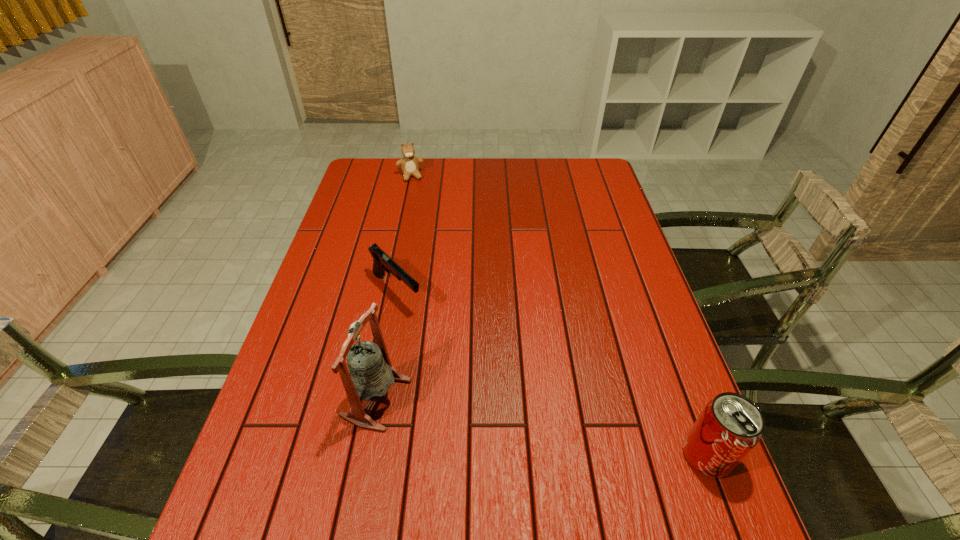
At what (x,y) coordinates should I click in order to perform the action: click on unoccupied area between the rightmost object and the second farthest object. Please return your answer as a coordinate pair (x, y). Looking at the image, I should click on (552, 374).

Find the location of a particular element. vacant area that lies between the farthest object and the third nearest object is located at coordinates (403, 234).

Identify the location of vacant space that is in between the farthest object and the third shortest object. (559, 316).

The image size is (960, 540). What are the coordinates of `free spot between the gun and the farthest object` in the screenshot? It's located at (403, 234).

You are a GUI agent. You are given a task and a screenshot of the screen. Output one action in this format:
    pyautogui.click(x=<x>, y=<y>)
    Task: Click on the vacant area that lies between the tallest object and the third shortest object
    
    Given the screenshot: What is the action you would take?
    pyautogui.click(x=541, y=427)

Where is `object that is the second closest to the tallest object`? Image resolution: width=960 pixels, height=540 pixels. object that is the second closest to the tallest object is located at coordinates (729, 427).

Select which object appears as the closest to the farthest object. Please provide its 2D coordinates. Your answer should be formatted as a tuple, i.e. [(x, y)], where the tuple contains the x and y coordinates of a point satisfying the conditions above.

[(382, 262)]

Identify the location of free space that satisfies the following two spatial constraints: 1. on the front side of the rightmost object; 2. on the left side of the tallest object. (366, 455).